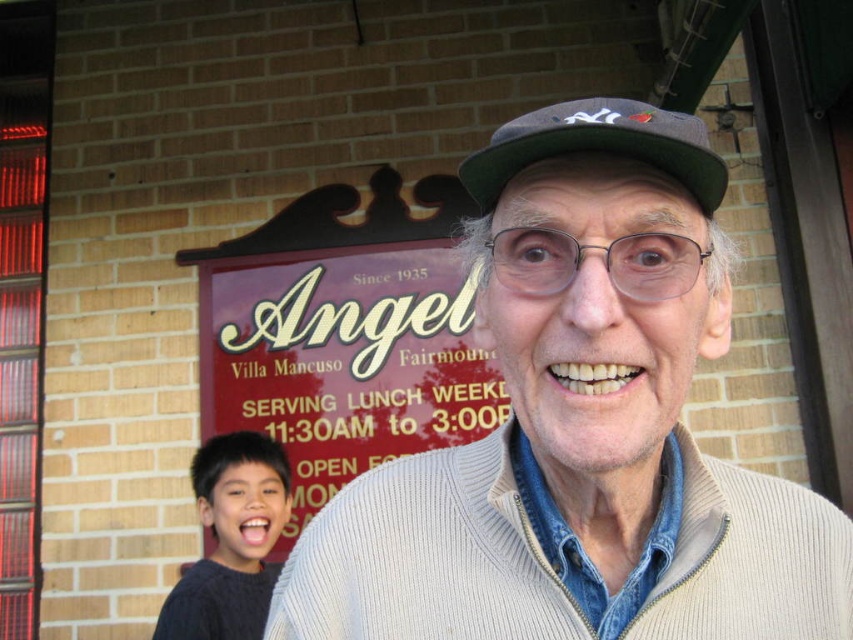
Question: Does white knit sweater at center have a smaller size compared to white ribbed sweater at center?

Choices:
 (A) no
 (B) yes

Answer: (A)

Question: Can you confirm if dark gray sweater at lower left is positioned below green fabric baseball cap at center?

Choices:
 (A) yes
 (B) no

Answer: (A)

Question: Among these objects, which one is nearest to the camera?

Choices:
 (A) green fabric baseball cap at center
 (B) white knit sweater at center

Answer: (B)

Question: Which of the following is the farthest from the observer?

Choices:
 (A) (259, 307)
 (B) (573, 109)
 (C) (601, 124)
 (D) (195, 566)

Answer: (A)

Question: Among these points, which one is farthest from the camera?

Choices:
 (A) (514, 468)
 (B) (412, 512)
 (C) (549, 141)

Answer: (B)

Question: Does white knit sweater at center have a greater width compared to white ribbed sweater at center?

Choices:
 (A) yes
 (B) no

Answer: (B)